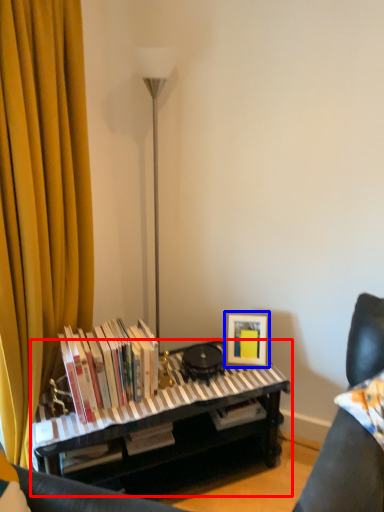
Question: Which object appears closest to the camera in this image, piano (highlighted by a red box) or picture frame (highlighted by a blue box)?

Choices:
 (A) piano
 (B) picture frame

Answer: (A)